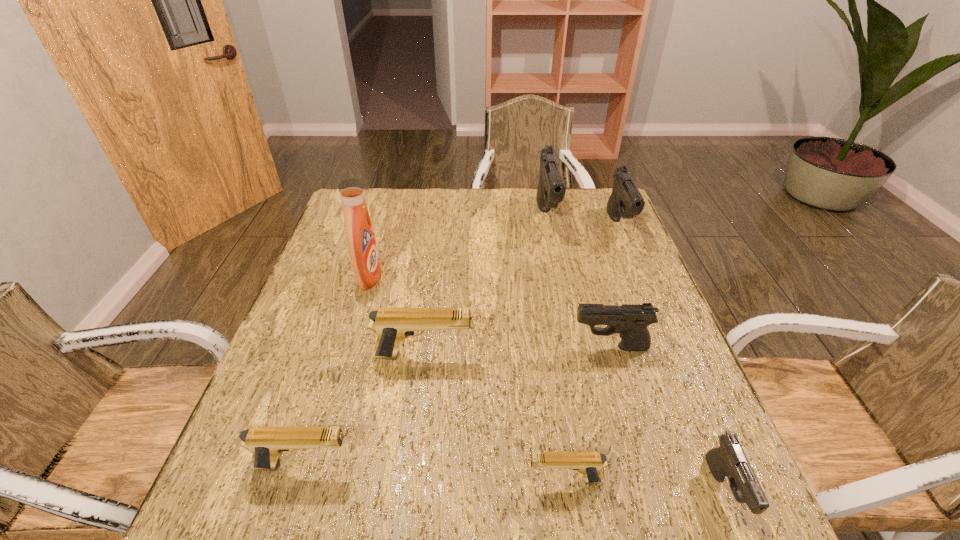
This screenshot has height=540, width=960. What are the coordinates of `free region at the right edge of the desktop` in the screenshot? It's located at (626, 247).

Find the location of a particular element. This screenshot has height=540, width=960. free space at the far right corner of the desktop is located at coordinates (584, 215).

Find the location of `blank region between the third farthest black pistol and the biggest tan pistol`. blank region between the third farthest black pistol and the biggest tan pistol is located at coordinates (516, 352).

Where is `vacant region between the seventh shortest object and the smallest black pistol`? Image resolution: width=960 pixels, height=540 pixels. vacant region between the seventh shortest object and the smallest black pistol is located at coordinates (636, 354).

At what (x,y) coordinates should I click in order to perform the action: click on free space between the tallest pistol and the second nearest tan pistol. Please return your answer as a coordinate pair (x, y). Image resolution: width=960 pixels, height=540 pixels. Looking at the image, I should click on (425, 341).

Identify the location of unoccupied position between the biggest black pistol and the farthest tan pistol. This screenshot has width=960, height=540. (485, 286).

The width and height of the screenshot is (960, 540). Identify the location of free point between the third farthest object and the second tallest pistol. (494, 252).

This screenshot has height=540, width=960. In order to click on empty space between the smallest black pistol and the biggest black pistol in this screenshot , I will do `click(636, 354)`.

The image size is (960, 540). Identify the location of empty space between the rightmost tan pistol and the second nearest tan pistol. (434, 472).

Find the location of `free point between the second smallest tan pistol and the biggest tan pistol`. free point between the second smallest tan pistol and the biggest tan pistol is located at coordinates (363, 410).